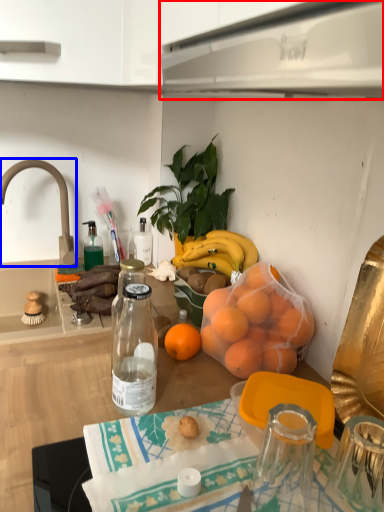
Question: Which of the following is the closest to the observer, kitchen appliance (highlighted by a red box) or faucet (highlighted by a blue box)?

Choices:
 (A) kitchen appliance
 (B) faucet

Answer: (A)